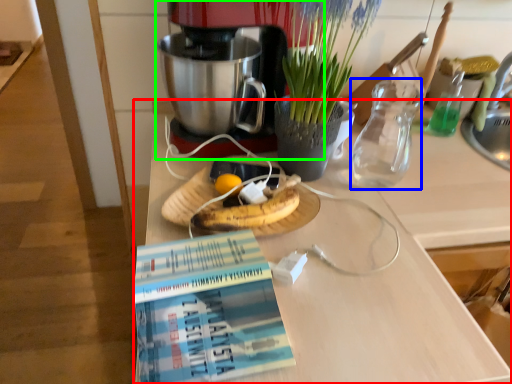
Question: Considering the real-world distances, which object is closest to desk (highlighted by a red box)? tea pot (highlighted by a blue box) or coffee maker (highlighted by a green box).

Choices:
 (A) tea pot
 (B) coffee maker

Answer: (A)